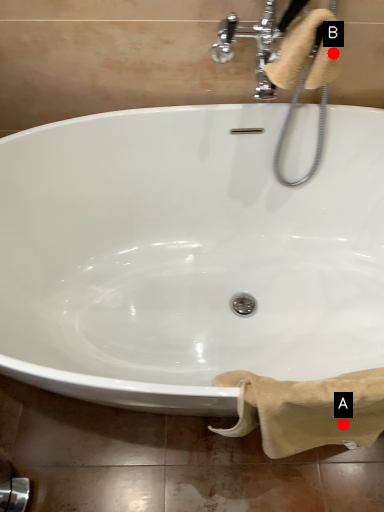
Question: Two points are circled on the image, labeled by A and B beside each circle. Which point is closer to the camera?

Choices:
 (A) A is closer
 (B) B is closer

Answer: (B)